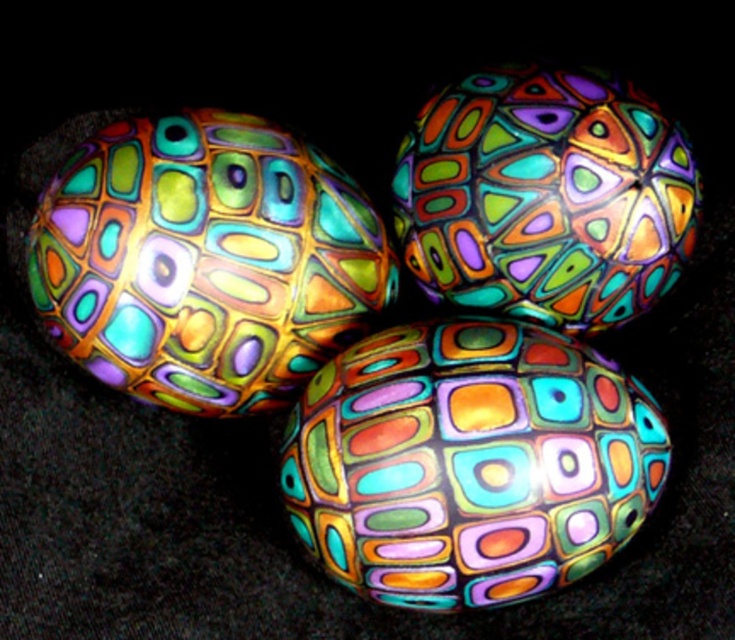
Is glossy ceramic easter egg at center wider than glossy ceramic easter egg at upper center?

Indeed, glossy ceramic easter egg at center has a greater width compared to glossy ceramic easter egg at upper center.

Which is behind, point (523, 556) or point (326, 292)?

The point (326, 292) is more distant.

The image size is (735, 640). In order to click on glossy ceramic easter egg at center in this screenshot , I will do `click(469, 461)`.

Between glossy ceramic easter egg at upper center and multicolored glass egg at center, which one appears on the right side from the viewer's perspective?

From the viewer's perspective, multicolored glass egg at center appears more on the right side.

Between glossy ceramic easter egg at upper center and multicolored glass egg at center, which one appears on the left side from the viewer's perspective?

From the viewer's perspective, glossy ceramic easter egg at upper center appears more on the left side.

Is point (215, 291) positioned behind point (684, 205)?

Yes, point (215, 291) is farther from viewer.

I want to click on glossy ceramic easter egg at upper center, so click(204, 260).

Can you confirm if glossy ceramic easter egg at center is bigger than multicolored glass egg at center?

Indeed, glossy ceramic easter egg at center has a larger size compared to multicolored glass egg at center.

Is glossy ceramic easter egg at center thinner than multicolored glass egg at center?

No, glossy ceramic easter egg at center is not thinner than multicolored glass egg at center.

Measure the distance between point (553,385) and camera.

They are 3.89 feet apart.

At what (x,y) coordinates should I click in order to perform the action: click on glossy ceramic easter egg at center. Please return your answer as a coordinate pair (x, y). The width and height of the screenshot is (735, 640). Looking at the image, I should click on (469, 461).